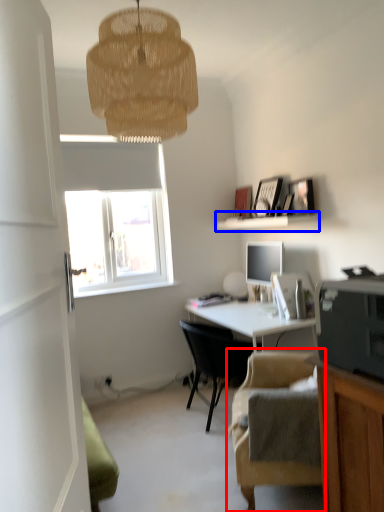
Question: Which object is further to the camera taking this photo, chair (highlighted by a red box) or shelf (highlighted by a blue box)?

Choices:
 (A) chair
 (B) shelf

Answer: (B)